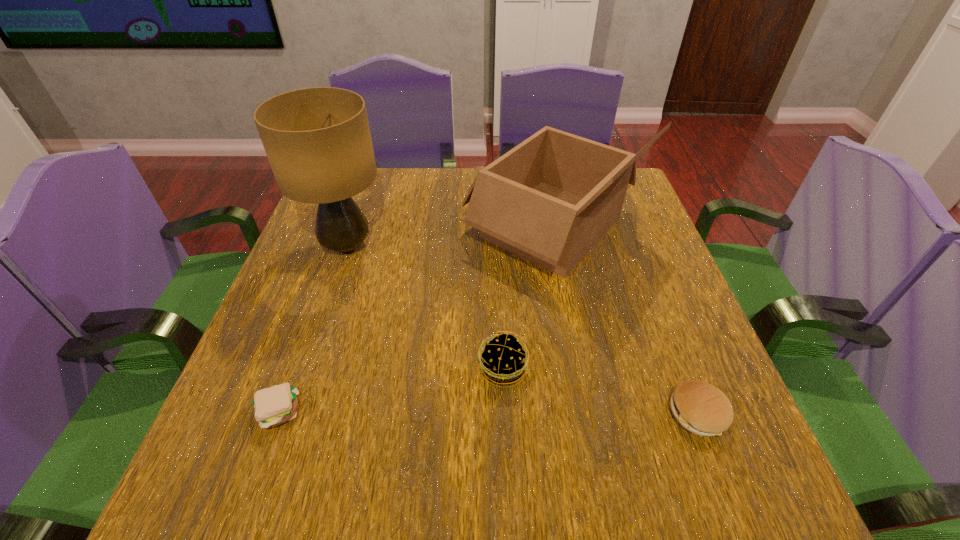
The image size is (960, 540). In order to click on vacant space in between the tallest patty and the shortest patty in this screenshot , I will do `click(390, 390)`.

I want to click on vacant area that lies between the second patty from left to right and the rightmost patty, so click(600, 392).

Identify the location of empty space that is in between the lampshade and the box. The image size is (960, 540). (449, 237).

What are the coordinates of `free point between the shortest object and the second patty from left to right` in the screenshot? It's located at (390, 390).

Choose which object is the nearest neighbor to the rightmost patty. Please provide its 2D coordinates. Your answer should be formatted as a tuple, i.e. [(x, y)], where the tuple contains the x and y coordinates of a point satisfying the conditions above.

[(502, 362)]

Locate which object is the closest to the shortest patty. Please provide its 2D coordinates. Your answer should be formatted as a tuple, i.e. [(x, y)], where the tuple contains the x and y coordinates of a point satisfying the conditions above.

[(318, 142)]

Select which patty is the third closest to the tallest object. Please provide its 2D coordinates. Your answer should be formatted as a tuple, i.e. [(x, y)], where the tuple contains the x and y coordinates of a point satisfying the conditions above.

[(699, 407)]

This screenshot has width=960, height=540. Find the location of `the third closest patty to the tallest object`. the third closest patty to the tallest object is located at coordinates (699, 407).

Find the location of `vacant space that satisfies the following two spatial constraints: 1. on the back side of the leftmost patty; 2. on the left side of the tallest object`. vacant space that satisfies the following two spatial constraints: 1. on the back side of the leftmost patty; 2. on the left side of the tallest object is located at coordinates (337, 246).

This screenshot has height=540, width=960. In order to click on blank space that satisfies the following two spatial constraints: 1. on the back side of the tallest object; 2. on the right side of the fourth shortest object in this screenshot , I will do `click(353, 227)`.